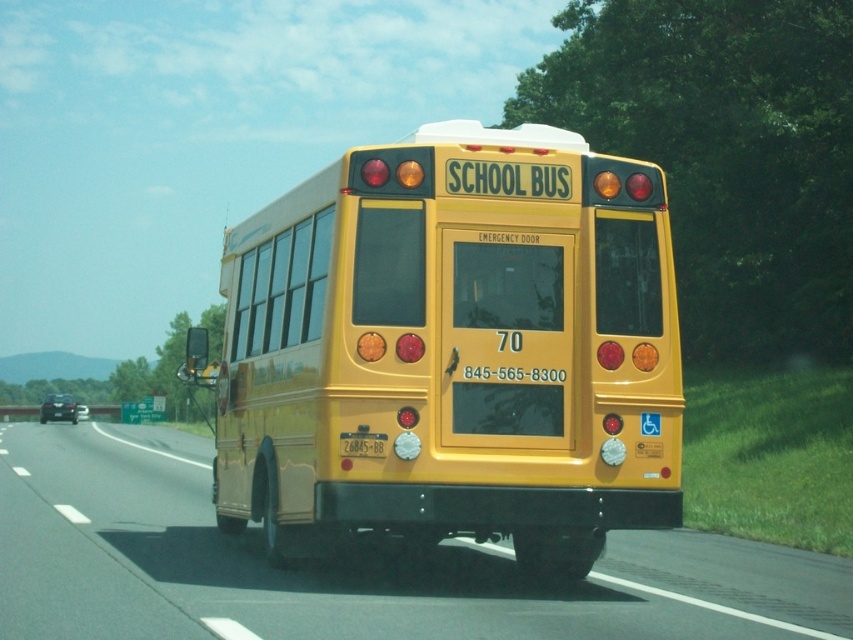
You are a driver approaching a yellow matte school bus at center on a highway. You notice a yellow matte license plate at center. Where is the license plate located in relation to the school bus?

The yellow matte license plate at center is above the yellow matte school bus at center.